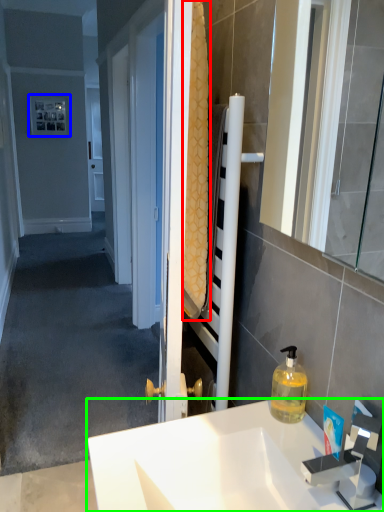
Question: Considering the real-world distances, which object is closest to bath towel (highlighted by a red box)? picture frame (highlighted by a blue box) or sink (highlighted by a green box).

Choices:
 (A) picture frame
 (B) sink

Answer: (B)